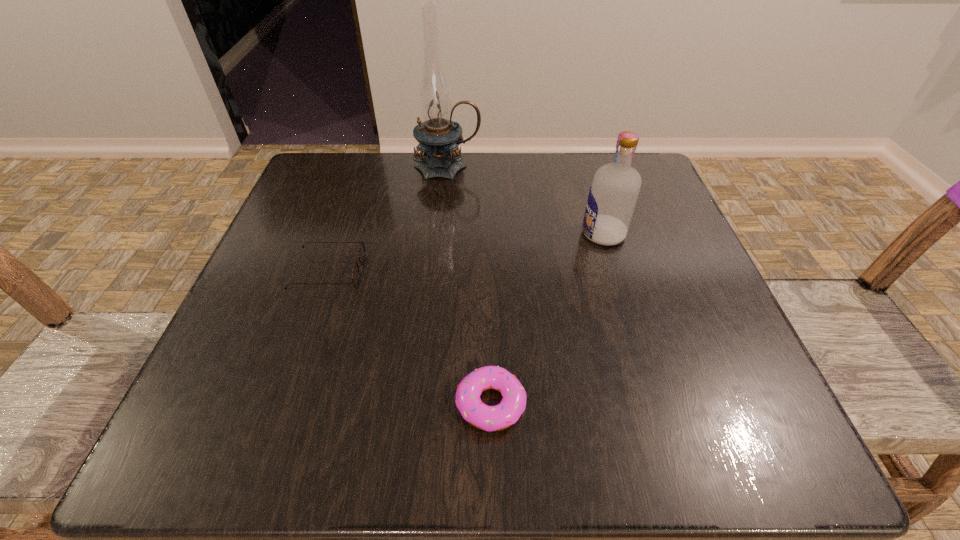
At what (x,y) coordinates should I click in order to perform the action: click on the farthest object. Please return your answer as a coordinate pair (x, y). The height and width of the screenshot is (540, 960). Looking at the image, I should click on (438, 137).

What are the coordinates of `oil lamp` in the screenshot? It's located at (438, 137).

Identify the location of the rightmost object. The image size is (960, 540). (613, 194).

Where is `vodka`? The width and height of the screenshot is (960, 540). vodka is located at coordinates (613, 194).

This screenshot has width=960, height=540. What are the coordinates of `the second nearest object` in the screenshot? It's located at (361, 254).

Locate an element on the screen. This screenshot has width=960, height=540. sunglasses is located at coordinates (361, 254).

This screenshot has height=540, width=960. Identify the location of the nearest object. point(489,418).

I want to click on blank space located 0.340m on the right of the farthest object, so click(628, 167).

This screenshot has width=960, height=540. I want to click on free space located on the label of the third nearest object, so click(540, 234).

The width and height of the screenshot is (960, 540). What are the coordinates of `free space located 0.390m on the label of the third nearest object` in the screenshot? It's located at (380, 234).